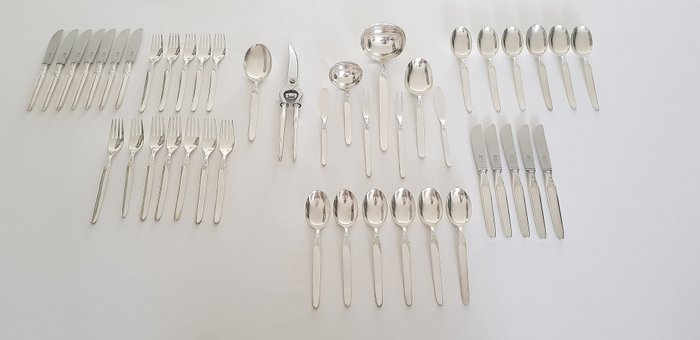
Locate an element on the screen. This screenshot has height=340, width=700. serving utensils is located at coordinates (414, 78), (386, 42), (343, 71), (288, 102), (260, 65).